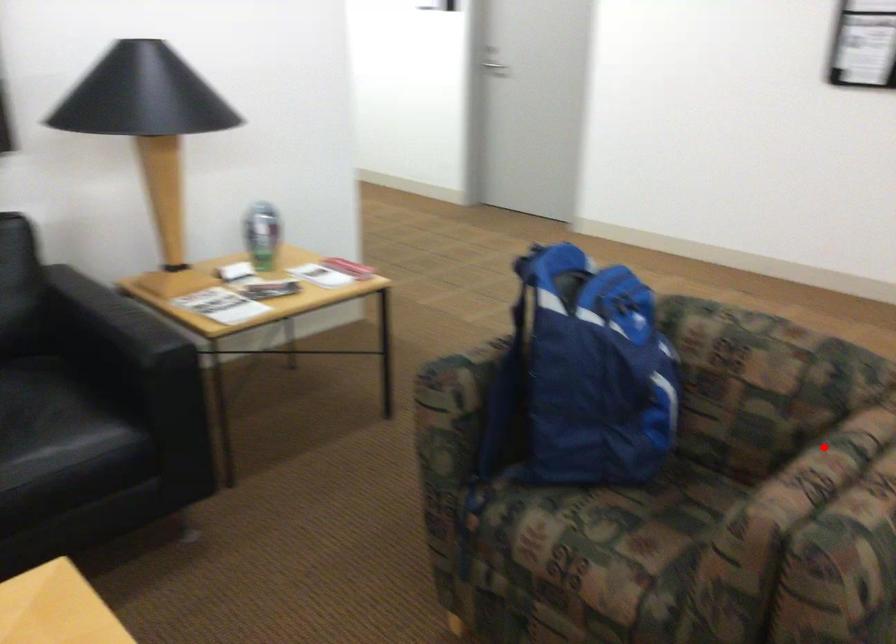
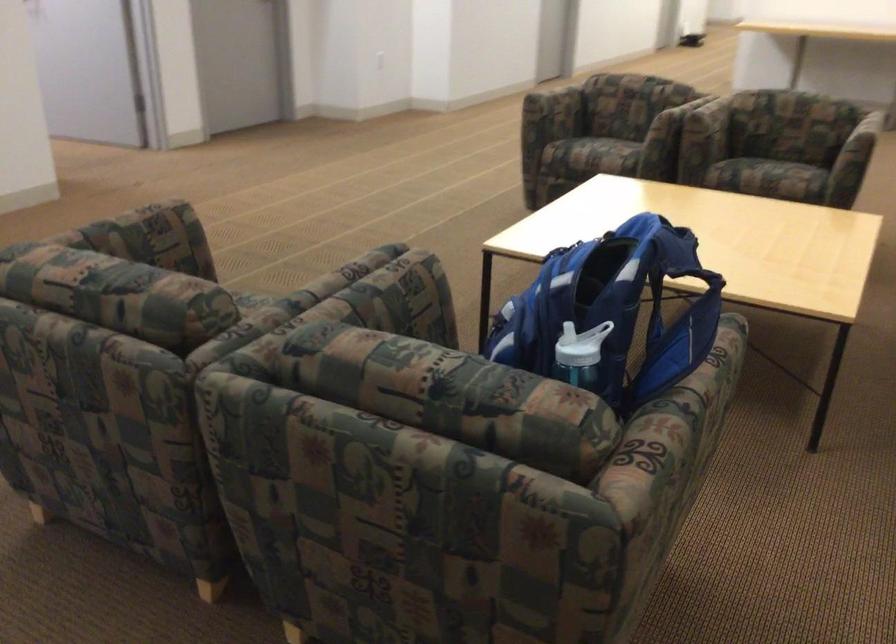
Find the pixel in the second image that matches the highlighted location in the first image.

(362, 292)